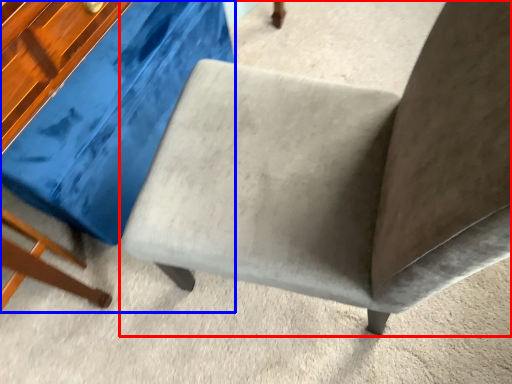
Question: Which point is further to the camera, chair (highlighted by a red box) or swivel chair (highlighted by a blue box)?

Choices:
 (A) chair
 (B) swivel chair

Answer: (B)